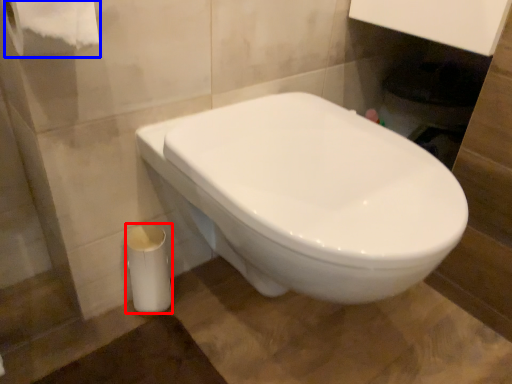
Question: Which object appears farthest to the camera in this image, porcelain (highlighted by a red box) or toilet paper (highlighted by a blue box)?

Choices:
 (A) porcelain
 (B) toilet paper

Answer: (A)